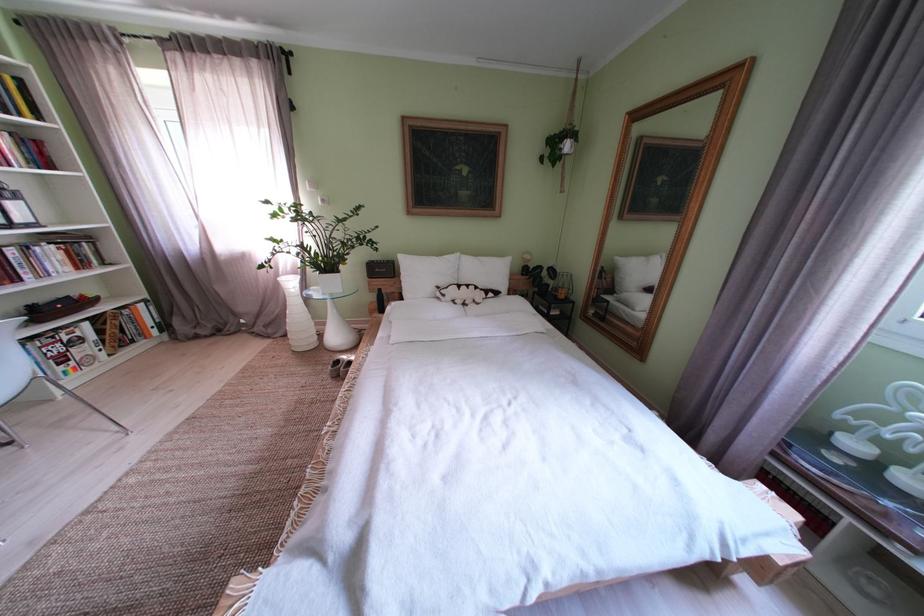
Find where to lift the dark wooden bowl. Please return your answer as a coordinate pair (x, y).

(58, 307)